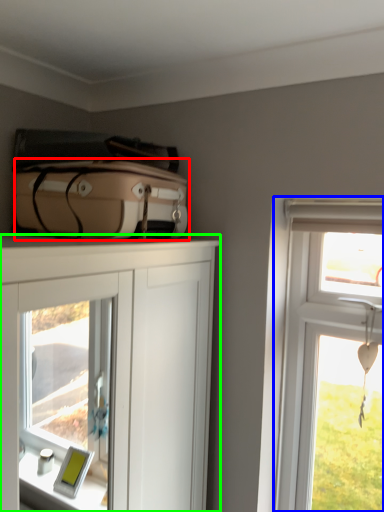
Question: Which is farther away from suitcase (highlighted by a red box)? window (highlighted by a blue box) or cabinetry (highlighted by a green box)?

Choices:
 (A) window
 (B) cabinetry

Answer: (B)